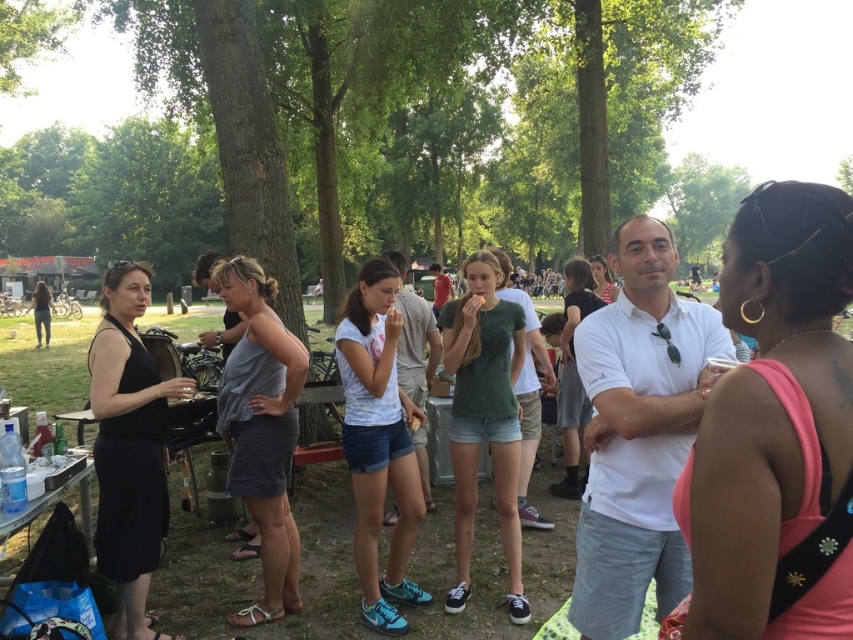
From the picture: You are at the park and want to walk from your current position to a tree located at point (480, 356). There is a person standing at point (161, 456). Will you pass by the person before reaching the tree?

Yes, you will pass by the person at point (161, 456) before reaching the tree at point (480, 356) because the person is in front of the tree.

You are organizing a photo shoot and need to place two models wearing the black matte dress at left and the white matte shirt at center. The photographer wants to ensure that the wider garment is positioned where it can be highlighted. Which model should be placed in the spotlight area?

The black matte dress at left should be placed in the spotlight area because its width surpasses that of the white matte shirt at center, making it the wider garment.